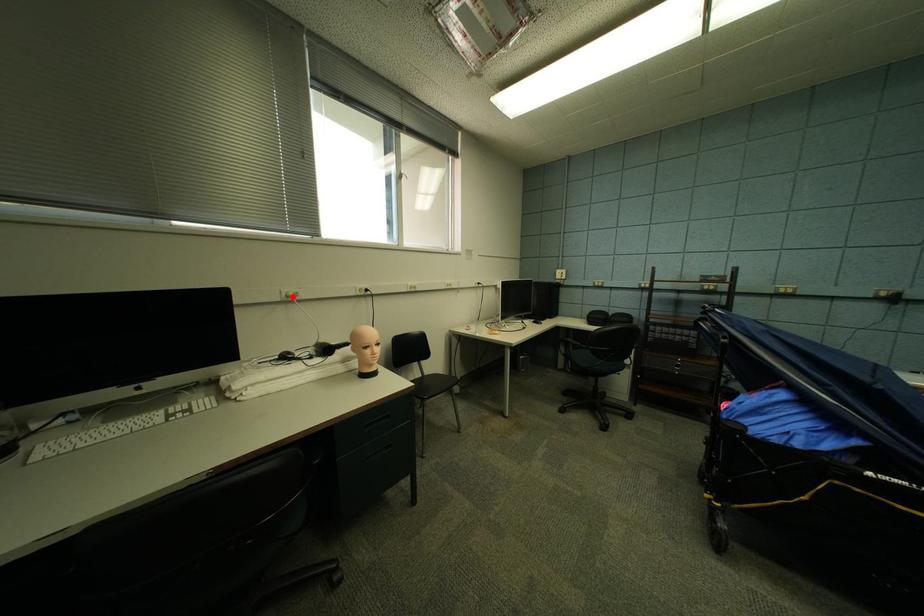
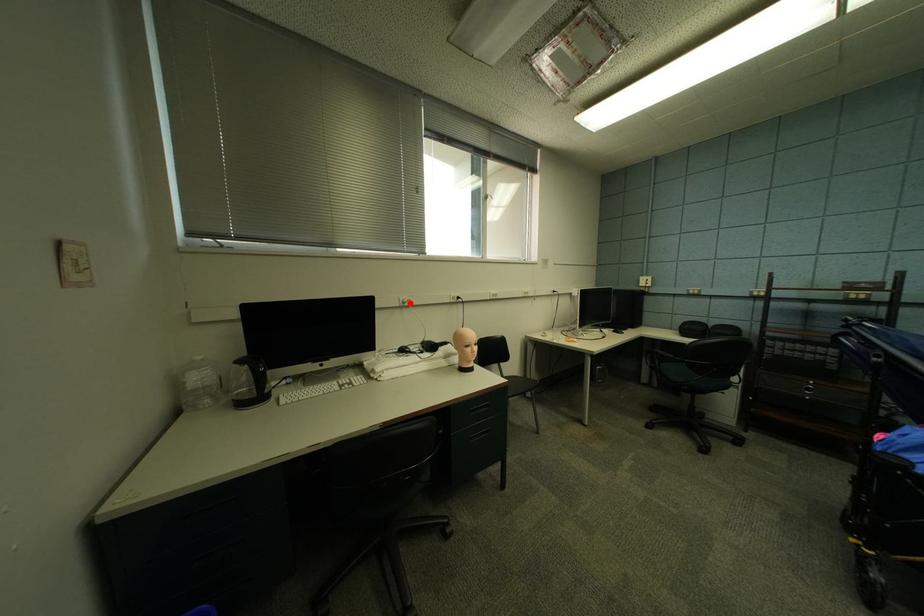
I am providing you with two images of the same scene from different viewpoints. A red point is marked on the first image and another point is marked on the second image. Does the point marked in image1 correspond to the same location as the one in image2?

Yes